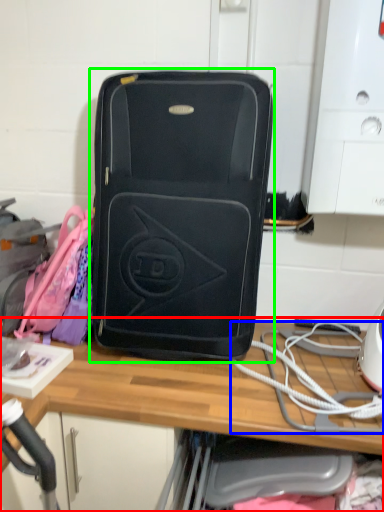
Question: Which is nearer to the desk (highlighted by a red box)? rope (highlighted by a blue box) or luggage and bags (highlighted by a green box).

Choices:
 (A) rope
 (B) luggage and bags

Answer: (A)